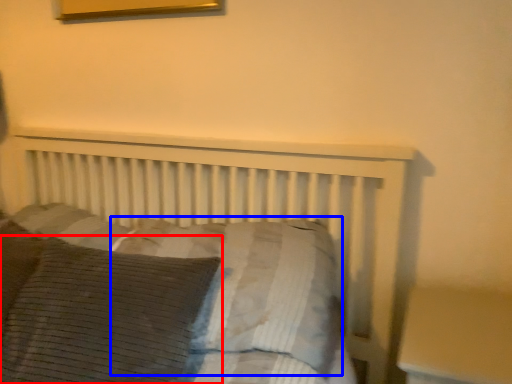
Question: Which object is further to the camera taking this photo, pillow (highlighted by a red box) or pillow (highlighted by a blue box)?

Choices:
 (A) pillow
 (B) pillow

Answer: (B)